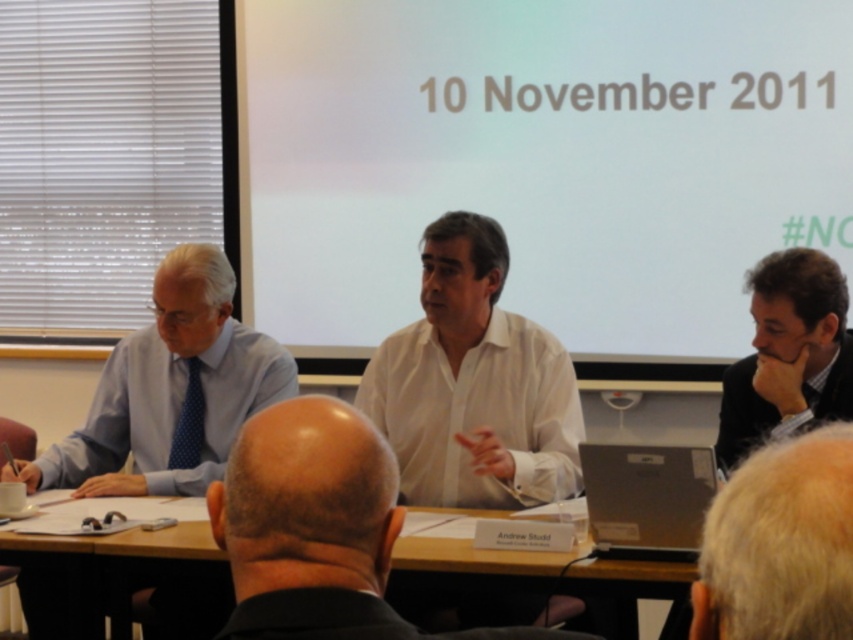
You are a conference attendee who needs to pass a document to the person at dark brown hair at right from the white smooth shirt at center. The document is 12 inches long. Can you pass it directly without needing to stand up?

The distance between white smooth shirt at center and dark brown hair at right is 25.88 inches, which is greater than the document length of 12 inches. Therefore, you can pass the document directly without standing up.

You are a photographer taking a group photo of the meeting participants. You need to arrange the participants so that the white smooth shirt at center and the dark brown hair at right are visible in the photo. Based on their current positions, which participant should be placed to the left of the other to maintain their original spatial relationship?

The white smooth shirt at center should be placed to the left of the dark brown hair at right because the white smooth shirt at center is positioned on the left side of dark brown hair at right in the current setup.

You are a participant in the meeting and need to reach the point marked as point (207,611) from your current position at point (598,577). Based on the spatial relationship between these two points, which direction should you move in to reach your destination?

Since point (207,611) is behind point (598,577), you should move backward from your current position at point (598,577) to reach point (207,611).